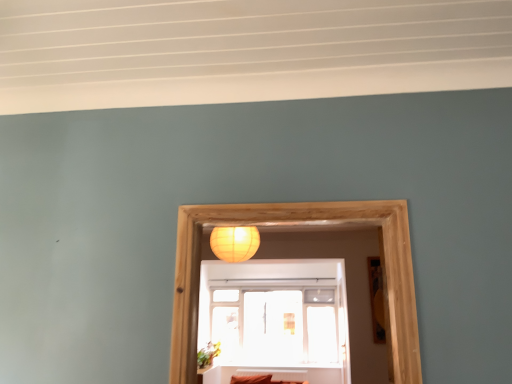
Question: Is transparent glass window at center inside or outside of matte yellow paper lantern at upper center?

Choices:
 (A) outside
 (B) inside

Answer: (A)

Question: From their relative heights in the image, would you say transparent glass window at center is taller or shorter than matte yellow paper lantern at upper center?

Choices:
 (A) short
 (B) tall

Answer: (B)

Question: Which object is the farthest from the transparent glass window at center?

Choices:
 (A) matte yellow paper lantern at upper center
 (B) wooden picture frame at right

Answer: (B)

Question: Considering the real-world distances, which object is farthest from the wooden picture frame at right?

Choices:
 (A) matte yellow paper lantern at upper center
 (B) transparent glass window at center

Answer: (B)